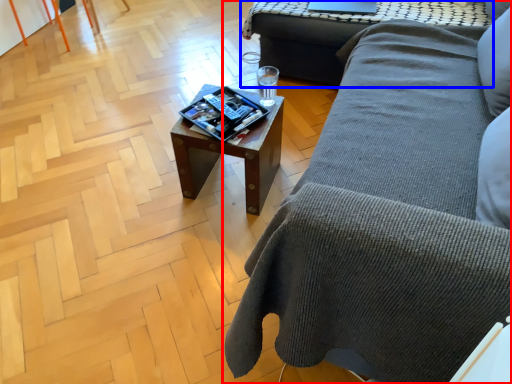
Question: Which of the following is the farthest to the observer, studio couch (highlighted by a red box) or table (highlighted by a blue box)?

Choices:
 (A) studio couch
 (B) table

Answer: (B)